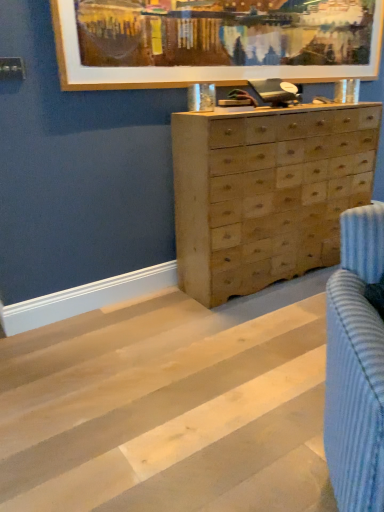
Question: Is natural wood chest of drawers at center aimed at wooden frame at upper center?

Choices:
 (A) yes
 (B) no

Answer: (B)

Question: Is natural wood chest of drawers at center at the left side of wooden frame at upper center?

Choices:
 (A) yes
 (B) no

Answer: (B)

Question: From a real-world perspective, is natural wood chest of drawers at center on wooden frame at upper center?

Choices:
 (A) yes
 (B) no

Answer: (B)

Question: From a real-world perspective, is natural wood chest of drawers at center beneath wooden frame at upper center?

Choices:
 (A) no
 (B) yes

Answer: (B)

Question: Is natural wood chest of drawers at center positioned with its back to wooden frame at upper center?

Choices:
 (A) no
 (B) yes

Answer: (A)

Question: Considering the relative sizes of natural wood chest of drawers at center and wooden frame at upper center in the image provided, is natural wood chest of drawers at center bigger than wooden frame at upper center?

Choices:
 (A) yes
 (B) no

Answer: (A)

Question: Considering the relative sizes of wooden frame at upper center and natural wood chest of drawers at center in the image provided, is wooden frame at upper center shorter than natural wood chest of drawers at center?

Choices:
 (A) yes
 (B) no

Answer: (A)

Question: Does wooden frame at upper center have a larger size compared to natural wood chest of drawers at center?

Choices:
 (A) yes
 (B) no

Answer: (B)

Question: Is wooden frame at upper center positioned beyond the bounds of natural wood chest of drawers at center?

Choices:
 (A) yes
 (B) no

Answer: (A)

Question: Is natural wood chest of drawers at center at the back of wooden frame at upper center?

Choices:
 (A) yes
 (B) no

Answer: (B)

Question: Is wooden frame at upper center oriented towards natural wood chest of drawers at center?

Choices:
 (A) yes
 (B) no

Answer: (B)

Question: Is natural wood chest of drawers at center surrounded by wooden frame at upper center?

Choices:
 (A) yes
 (B) no

Answer: (B)

Question: Is natural wood floor at center not close to wooden frame at upper center?

Choices:
 (A) no
 (B) yes

Answer: (B)